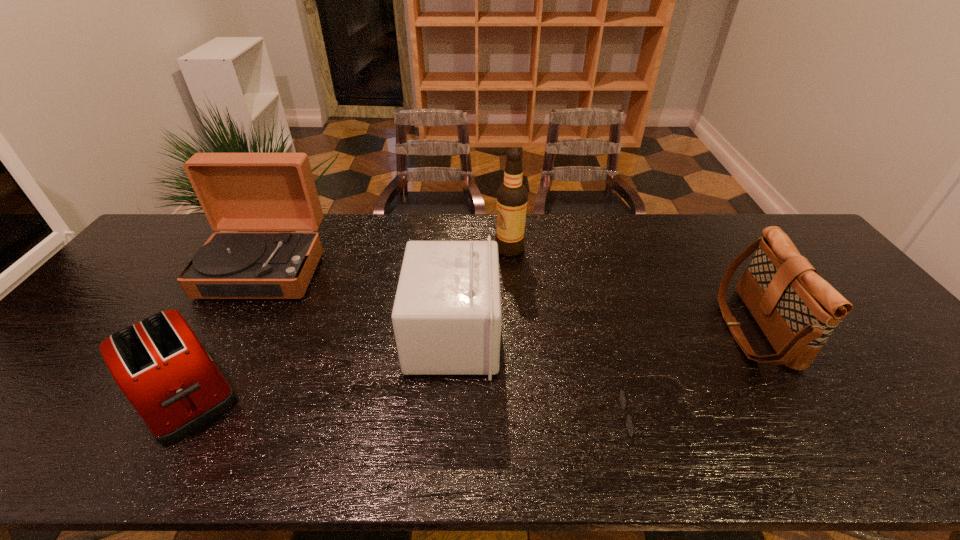
Find the location of a particular element. This screenshot has height=540, width=960. phonograph record at the far edge is located at coordinates 237,191.

Locate an element on the screen. The width and height of the screenshot is (960, 540). toaster located in the near edge section of the desktop is located at coordinates (160, 365).

Image resolution: width=960 pixels, height=540 pixels. Identify the location of spectacles situated at the near edge. (622, 397).

Locate an element on the screen. The image size is (960, 540). blank area at the far edge is located at coordinates (528, 232).

In the image, there is a desktop. Identify the location of vacant space at the near edge. This screenshot has height=540, width=960. (278, 443).

The image size is (960, 540). In the image, there is a desktop. Identify the location of vacant region at the left edge. (141, 267).

In the image, there is a desktop. Where is `vacant space at the right edge`? Image resolution: width=960 pixels, height=540 pixels. vacant space at the right edge is located at coordinates (912, 406).

The height and width of the screenshot is (540, 960). Find the location of `blank space at the far left corner of the desktop`. blank space at the far left corner of the desktop is located at coordinates (188, 237).

Identify the location of blank area at the near left corner. coord(26,446).

At what (x,y) coordinates should I click in order to perform the action: click on vacant space at the near right corner of the desktop. Please return your answer as a coordinate pair (x, y). This screenshot has width=960, height=540. Looking at the image, I should click on (939, 435).